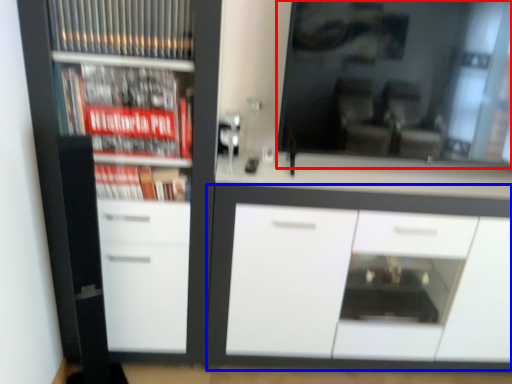
Question: Which point is further to the camera, mirror (highlighted by a red box) or cabinetry (highlighted by a blue box)?

Choices:
 (A) mirror
 (B) cabinetry

Answer: (B)